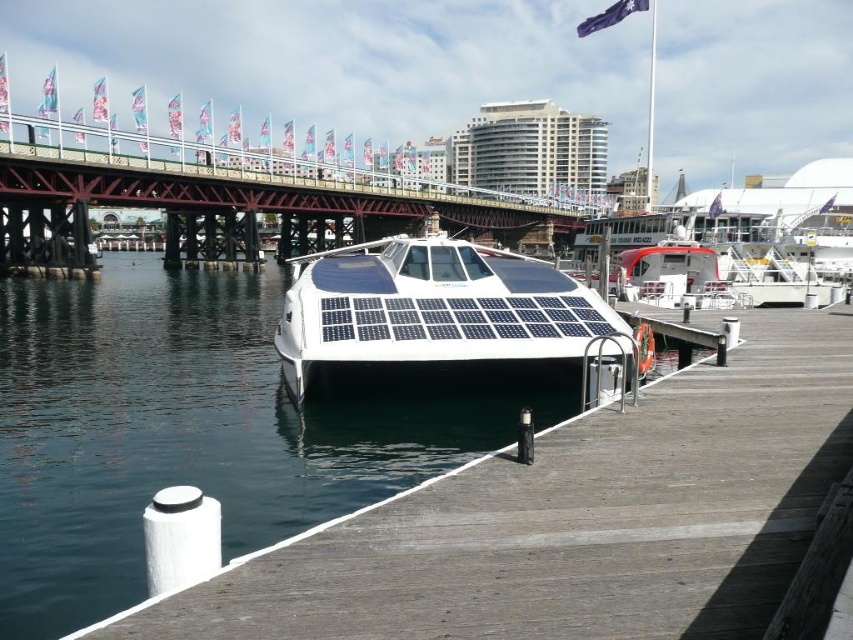
Question: Among these points, which one is nearest to the camera?

Choices:
 (A) (387, 413)
 (B) (325, 184)
 (C) (659, 266)
 (D) (393, 324)

Answer: (D)

Question: Is metallic bridge at upper center bigger than white glossy boat at right?

Choices:
 (A) yes
 (B) no

Answer: (A)

Question: Can you confirm if metallic bridge at upper center is wider than white glossy boat at right?

Choices:
 (A) no
 (B) yes

Answer: (B)

Question: Which point is farther to the camera?

Choices:
 (A) white glossy solar panel boat at center
 (B) metallic bridge at upper center

Answer: (B)

Question: Which point is farther to the camera?

Choices:
 (A) white glossy boat at right
 (B) metallic bridge at upper center
 (C) transparent glass water at center

Answer: (B)

Question: Can you confirm if metallic bridge at upper center is positioned to the left of white glossy solar panel boat at center?

Choices:
 (A) no
 (B) yes

Answer: (A)